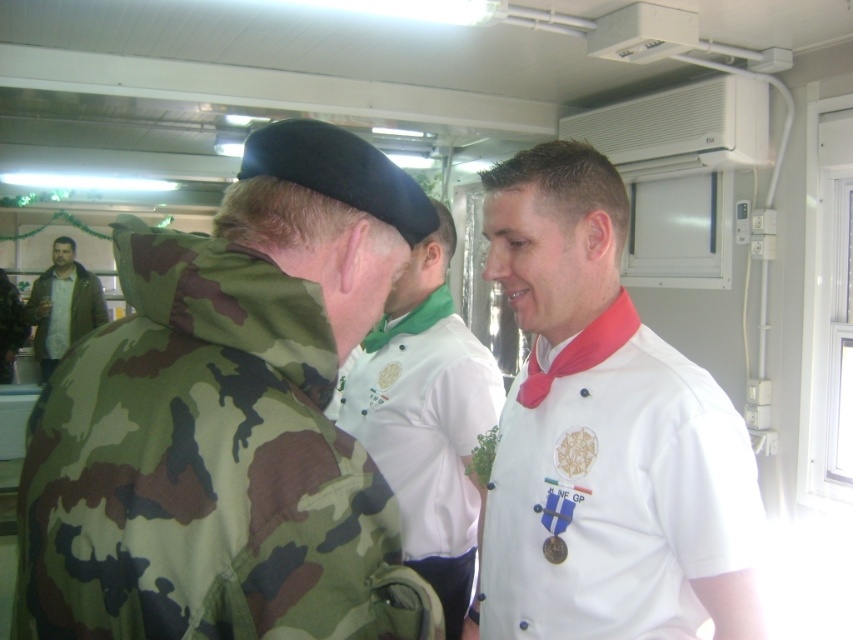
You are a photographer standing in the enclosed space. You want to take a closeup of the camo fabric jacket at left without including the chef in the frame. Given that your camera has a minimum focusing distance of 18 inches, can you achieve this?

The camo fabric jacket at left is 21.17 inches away from the camera, which is beyond the minimum focusing distance of 18 inches. Therefore, you can take a closeup of the camo fabric jacket at left without including the chef in the frame.

You are standing in the enclosed space and need to reach the air conditioning unit on the ceiling. There is a camo fabric jacket at left. Can you use the jacket to reach the unit?

The camo fabric jacket at left is located at point (228, 420), but without knowing the dimensions of the jacket or the distance to the air conditioning unit, it is impossible to determine if it can be used to reach the unit.